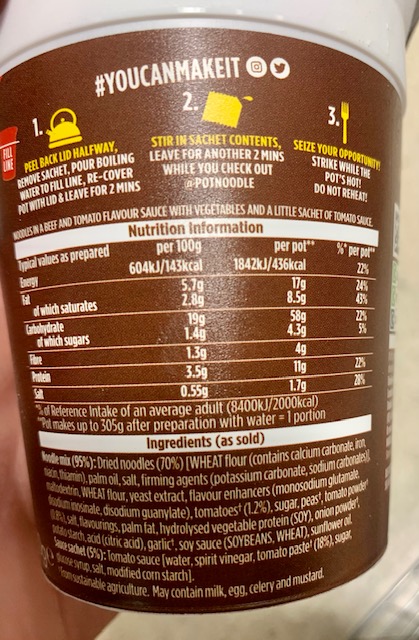
This screenshot has height=640, width=419. I want to click on counter, so click(365, 595).